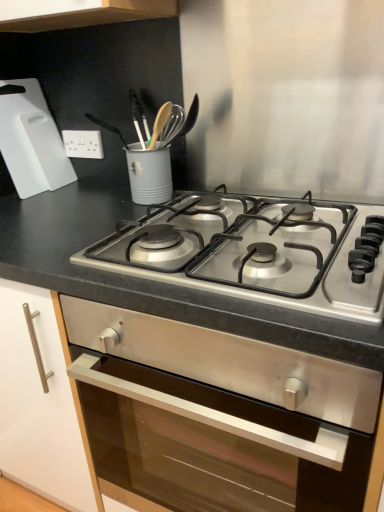
Locate an element on the screen. This screenshot has width=384, height=512. slate gray countertop at center is located at coordinates (152, 280).

Locate an element on the screen. Image resolution: width=384 pixels, height=512 pixels. white plastic cutting board at upper left is located at coordinates (31, 140).

What do you see at coordinates (250, 255) in the screenshot? The width and height of the screenshot is (384, 512). I see `stainless steel gas stove at center` at bounding box center [250, 255].

Where is `slate gray countertop at center`? This screenshot has width=384, height=512. slate gray countertop at center is located at coordinates (152, 280).

Considering the sizes of objects stainless steel gas stove at center and white plastic cutting board at upper left in the image provided, who is thinner, stainless steel gas stove at center or white plastic cutting board at upper left?

Thinner between the two is white plastic cutting board at upper left.

Is stainless steel gas stove at center behind white plastic cutting board at upper left?

No, stainless steel gas stove at center is in front of white plastic cutting board at upper left.

Who is smaller, stainless steel gas stove at center or white plastic cutting board at upper left?

Smaller between the two is white plastic cutting board at upper left.

Is stainless steel gas stove at center closer to the viewer compared to slate gray countertop at center?

No, stainless steel gas stove at center is behind slate gray countertop at center.

Considering the sizes of stainless steel gas stove at center and slate gray countertop at center in the image, is stainless steel gas stove at center taller or shorter than slate gray countertop at center?

Clearly, stainless steel gas stove at center is shorter compared to slate gray countertop at center.

Which point is more distant from viewer, (110, 262) or (117, 200)?

Positioned behind is point (117, 200).

From a real-world perspective, is stainless steel gas stove at center over slate gray countertop at center?

Indeed, from a real-world perspective, stainless steel gas stove at center stands above slate gray countertop at center.

This screenshot has height=512, width=384. I want to click on electric outlet below the white plastic cutting board at upper left (from the image's perspective), so click(83, 144).

Which object is closer to the camera, white plastic cutting board at upper left or white plastic electric outlet at upper left?

Positioned in front is white plastic cutting board at upper left.

Which of these two, white plastic cutting board at upper left or white plastic electric outlet at upper left, stands shorter?

white plastic electric outlet at upper left is shorter.

Between white plastic electric outlet at upper left and white plastic cutting board at upper left, which one has smaller width?

white plastic electric outlet at upper left is thinner.

Would you say white plastic electric outlet at upper left is a long distance from white plastic cutting board at upper left?

white plastic electric outlet at upper left is actually quite close to white plastic cutting board at upper left.

Consider the image. Is white plastic cutting board at upper left inside white plastic electric outlet at upper left?

No, white plastic cutting board at upper left is located outside of white plastic electric outlet at upper left.

Between point (88, 154) and point (44, 157), which one is positioned in front?

Point (44, 157)

Is white plastic electric outlet at upper left beside stainless steel gas stove at center?

white plastic electric outlet at upper left and stainless steel gas stove at center are clearly separated.

Is point (74, 151) less distant than point (341, 308)?

No, it is not.

In terms of size, does white plastic electric outlet at upper left appear bigger or smaller than stainless steel gas stove at center?

In the image, white plastic electric outlet at upper left appears to be smaller than stainless steel gas stove at center.

From a real-world perspective, is slate gray countertop at center located higher than stainless steel gas stove at center?

No.

Is slate gray countertop at center oriented away from stainless steel gas stove at center?

No.

Which is more to the left, slate gray countertop at center or stainless steel gas stove at center?

stainless steel gas stove at center.

Which object is wider, slate gray countertop at center or stainless steel gas stove at center?

slate gray countertop at center.

Considering the relative positions of slate gray countertop at center and white plastic electric outlet at upper left in the image provided, is slate gray countertop at center behind white plastic electric outlet at upper left?

No.

From the image's perspective, which one is positioned higher, slate gray countertop at center or white plastic electric outlet at upper left?

white plastic electric outlet at upper left appears higher in the image.

Is slate gray countertop at center located outside white plastic electric outlet at upper left?

Yes, slate gray countertop at center is located beyond the bounds of white plastic electric outlet at upper left.

Is slate gray countertop at center wider than white plastic electric outlet at upper left?

Indeed, slate gray countertop at center has a greater width compared to white plastic electric outlet at upper left.

This screenshot has width=384, height=512. What are the coordinates of `gas stove lying on the right of white plastic cutting board at upper left` in the screenshot? It's located at (250, 255).

Find the location of a particular element. The height and width of the screenshot is (512, 384). countertop that appears below the stainless steel gas stove at center (from a real-world perspective) is located at coordinates (152, 280).

Considering their positions, is slate gray countertop at center positioned further to white plastic electric outlet at upper left than stainless steel gas stove at center?

stainless steel gas stove at center lies further to white plastic electric outlet at upper left than the other object.

From the image, which object appears to be farther from white plastic electric outlet at upper left, slate gray countertop at center or white plastic cutting board at upper left?

slate gray countertop at center.

Estimate the real-world distances between objects in this image. Which object is further from white plastic electric outlet at upper left, white plastic cutting board at upper left or slate gray countertop at center?

slate gray countertop at center is positioned further to the anchor white plastic electric outlet at upper left.

When comparing their distances from stainless steel gas stove at center, does white plastic electric outlet at upper left or white plastic cutting board at upper left seem further?

white plastic electric outlet at upper left lies further to stainless steel gas stove at center than the other object.

Looking at the image, which one is located closer to stainless steel gas stove at center, white plastic cutting board at upper left or slate gray countertop at center?

slate gray countertop at center.

Looking at the image, which one is located closer to slate gray countertop at center, stainless steel gas stove at center or white plastic electric outlet at upper left?

stainless steel gas stove at center is positioned closer to the anchor slate gray countertop at center.

Looking at the image, which one is located closer to white plastic cutting board at upper left, slate gray countertop at center or white plastic electric outlet at upper left?

The object closer to white plastic cutting board at upper left is white plastic electric outlet at upper left.

Looking at this image, looking at the image, which one is located closer to white plastic cutting board at upper left, white plastic electric outlet at upper left or slate gray countertop at center?

white plastic electric outlet at upper left is closer to white plastic cutting board at upper left.

Locate an element on the screen. The image size is (384, 512). kitchen appliance between stainless steel gas stove at center and white plastic electric outlet at upper left from front to back is located at coordinates (31, 140).

Find the location of `kitchen appliance between slate gray countertop at center and white plastic electric outlet at upper left along the z-axis`. kitchen appliance between slate gray countertop at center and white plastic electric outlet at upper left along the z-axis is located at coordinates (31, 140).

I want to click on gas stove between slate gray countertop at center and white plastic electric outlet at upper left from front to back, so click(x=250, y=255).

The height and width of the screenshot is (512, 384). What are the coordinates of `gas stove between white plastic cutting board at upper left and slate gray countertop at center in the vertical direction` in the screenshot? It's located at (250, 255).